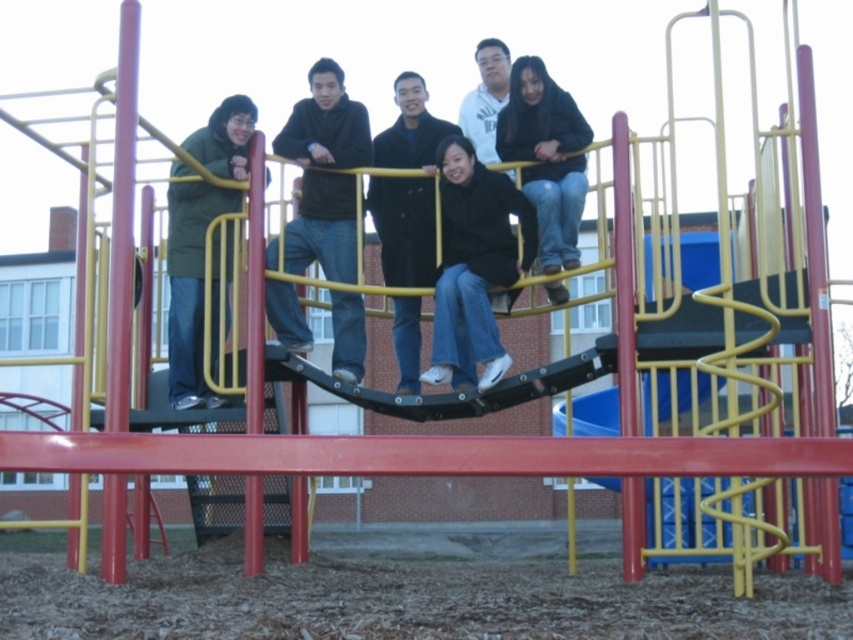
Can you confirm if green matte jacket at left is positioned to the right of white matte jacket at upper center?

Incorrect, green matte jacket at left is not on the right side of white matte jacket at upper center.

Which is above, green matte jacket at left or white matte jacket at upper center?

Positioned higher is white matte jacket at upper center.

Is point (171, 317) in front of point (503, 54)?

Yes, point (171, 317) is closer to viewer.

Find the location of `green matte jacket at left`. green matte jacket at left is located at coordinates (190, 284).

Is black matte jacket at center bigger than green matte jacket at left?

No, black matte jacket at center is not bigger than green matte jacket at left.

In the scene shown: Between black matte jacket at center and green matte jacket at left, which one appears on the right side from the viewer's perspective?

black matte jacket at center is more to the right.

Who is more forward, (479, 221) or (219, 120)?

Point (479, 221)

Locate an element on the screen. black matte jacket at center is located at coordinates (474, 262).

Consider the image. Is black matte jacket at center wider than white matte jacket at upper center?

Incorrect, black matte jacket at center's width does not surpass white matte jacket at upper center's.

Is black matte jacket at center shorter than white matte jacket at upper center?

Correct, black matte jacket at center is not as tall as white matte jacket at upper center.

Is point (495, 195) positioned after point (491, 138)?

No, it is not.

Locate an element on the screen. Image resolution: width=853 pixels, height=640 pixels. black matte jacket at center is located at coordinates (474, 262).